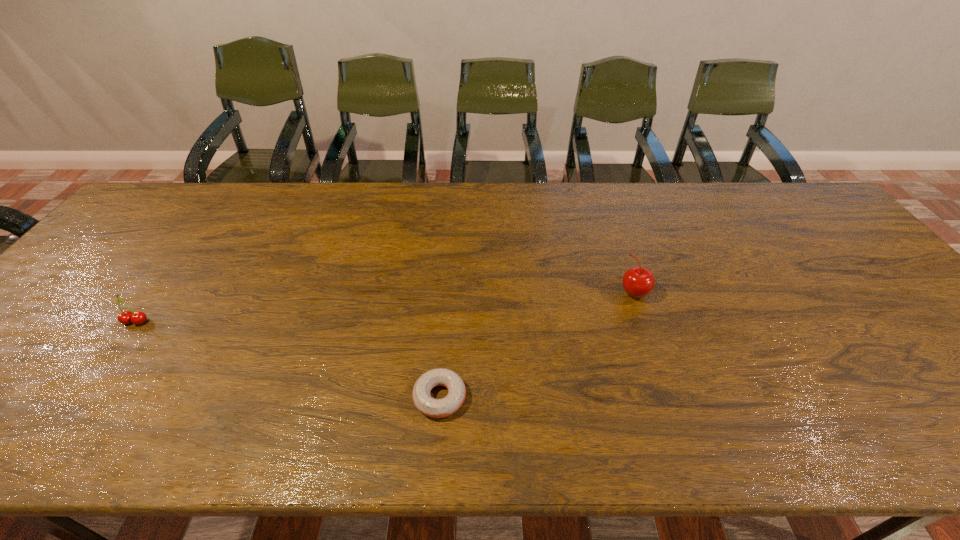
I want to click on blank space at the far edge of the desktop, so click(545, 222).

Locate an element on the screen. This screenshot has height=540, width=960. free space at the near edge of the desktop is located at coordinates (207, 450).

I want to click on vacant region at the right edge of the desktop, so click(x=859, y=249).

Find the location of a particular element. This screenshot has width=960, height=540. empty location between the second object from right to left and the rightmost object is located at coordinates (537, 345).

This screenshot has width=960, height=540. I want to click on vacant region between the nearer cherry and the rightmost object, so click(385, 307).

Find the location of a particular element. The height and width of the screenshot is (540, 960). vacant space in between the doughnut and the farthest object is located at coordinates pos(537,345).

At what (x,y) coordinates should I click in order to perform the action: click on free space between the rightmost object and the nearest object. Please return your answer as a coordinate pair (x, y). The height and width of the screenshot is (540, 960). Looking at the image, I should click on (537, 345).

I want to click on empty space that is in between the second tallest object and the nearest object, so click(288, 359).

The height and width of the screenshot is (540, 960). What are the coordinates of `vacant area between the shortest object and the second nearest object` in the screenshot? It's located at pos(288,359).

Where is `free spot between the farther cherry and the second tallest object`? Image resolution: width=960 pixels, height=540 pixels. free spot between the farther cherry and the second tallest object is located at coordinates (385, 307).